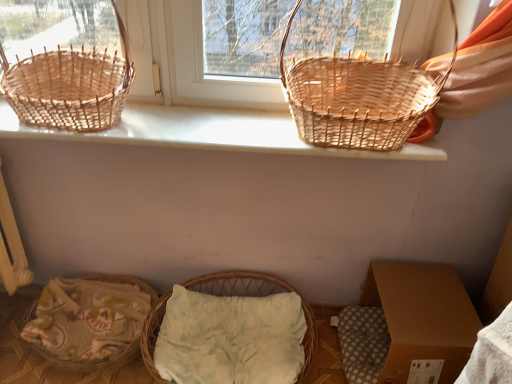
Identify the location of empty space that is ontop of brown cardboard box at lower right. The image size is (512, 384). (420, 297).